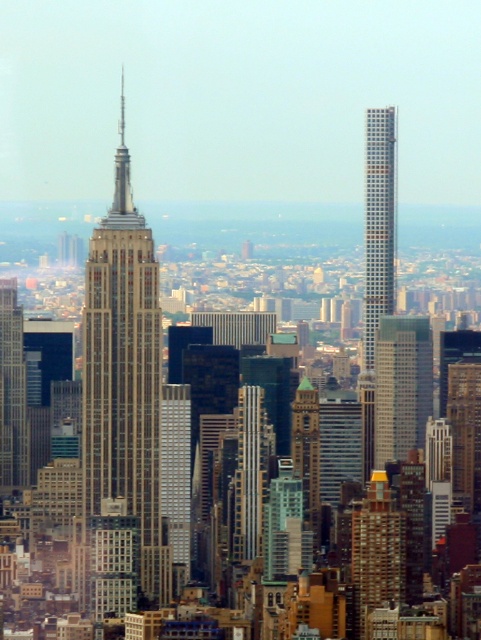
You are standing in the city looking at the Empire State Building and the modern skyscraper. There are two points marked in the image. The first point is at coordinates point [149,289] and the second is at point [366,310]. Which point is closer to you?

Point [149,289] is closer to the camera than point [366,310].